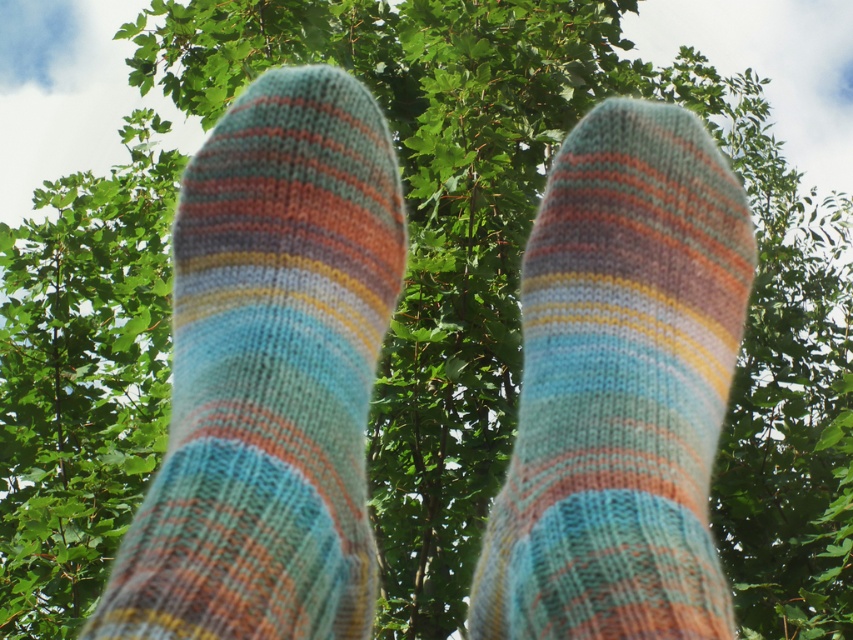
Does striped woolen sock at center have a lesser height compared to knitted woolen sock at center?

Incorrect, striped woolen sock at center's height does not fall short of knitted woolen sock at center's.

Is striped woolen sock at center taller than knitted woolen sock at center?

Correct, striped woolen sock at center is much taller as knitted woolen sock at center.

Between point (323, 291) and point (622, 273), which one is positioned in front?

Point (323, 291) is in front.

Locate an element on the screen. striped woolen sock at center is located at coordinates (270, 374).